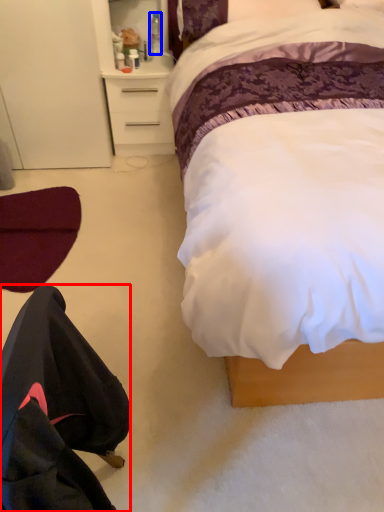
Question: Which object appears closest to the camera in this image, robe (highlighted by a red box) or bottle (highlighted by a blue box)?

Choices:
 (A) robe
 (B) bottle

Answer: (A)